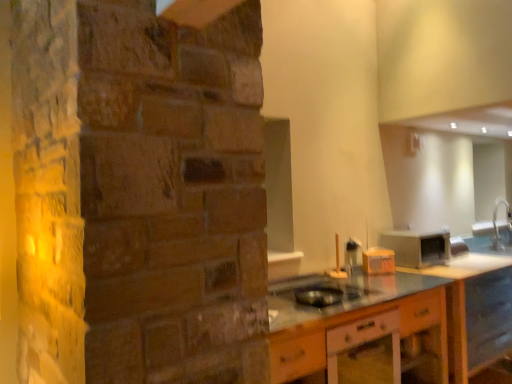
Question: Considering their positions, is metallic silver toaster at right, marked as the 3th appliance in a left-to-right arrangement, located in front of or behind black plastic bowl at center, which is counted as the 1th appliance, starting from the left?

Choices:
 (A) behind
 (B) front

Answer: (A)

Question: From a real-world perspective, relative to black plastic bowl at center, which is counted as the third appliance, starting from the right, is metallic silver toaster at right, which is the first appliance in right-to-left order, vertically above or below?

Choices:
 (A) below
 (B) above

Answer: (B)

Question: Estimate the real-world distances between objects in this image. Which object is farther from the metallic silver toaster at right, marked as the 3th appliance in a left-to-right arrangement?

Choices:
 (A) silver metallic faucet at right
 (B) wooden cabinet at lower center
 (C) black plastic bowl at center, which is counted as the 1th appliance, starting from the left
 (D) orange plastic toaster at center, arranged as the 2th appliance when viewed from the right

Answer: (A)

Question: Considering the real-world distances, which object is closest to the wooden cabinet at lower center?

Choices:
 (A) black plastic bowl at center, which is counted as the 1th appliance, starting from the left
 (B) silver metallic faucet at right
 (C) metallic silver toaster at right, positioned as the 3th appliance in front-to-back order
 (D) orange plastic toaster at center, placed as the 2th appliance when sorted from front to back

Answer: (A)